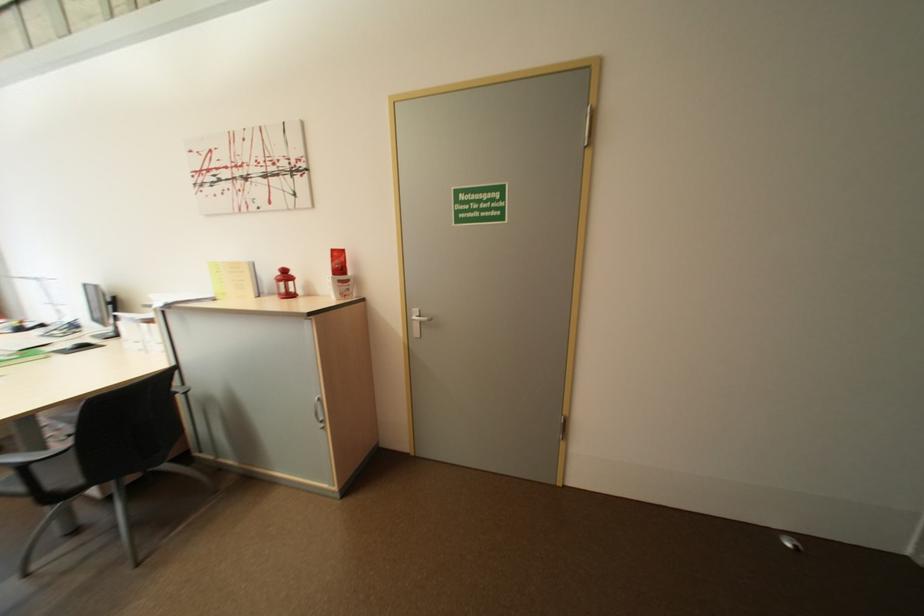
Find where to pull the silver cabinet handle. Please return your answer as a coordinate pair (x, y).

(319, 411)